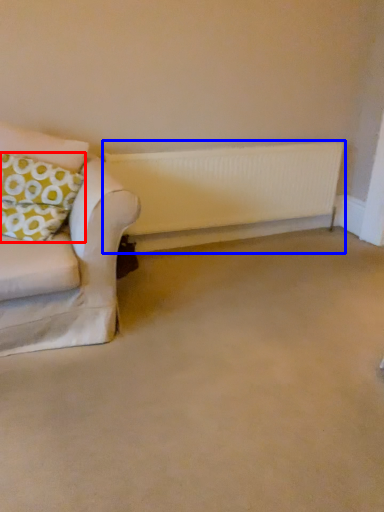
Question: Which object appears farthest to the camera in this image, pillow (highlighted by a red box) or radiator (highlighted by a blue box)?

Choices:
 (A) pillow
 (B) radiator

Answer: (B)